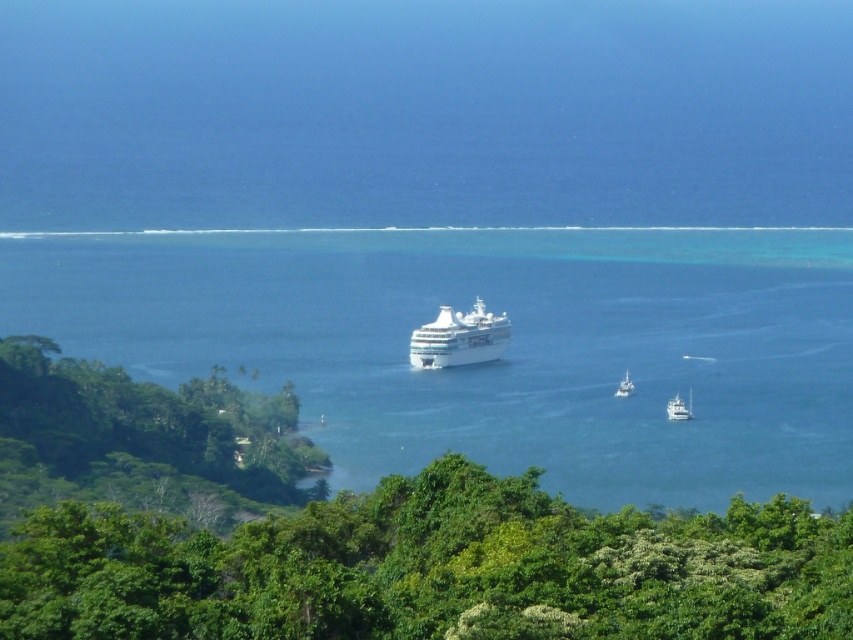
You are a photographer planning to capture both the white glossy boat at lower right and the white glossy boat at center in a single frame. Which boat should you position closer to the camera to ensure both are clearly visible in the photo?

You should position the white glossy boat at lower right closer to the camera because it is larger in size than the white glossy boat at center, ensuring both boats appear balanced in the frame.

Looking at this image, you are standing on the shore looking at the cruise ship. If you want to reach the blue water at center, which direction should you move relative to your current position?

The blue water at center is located at coordinates point (x=505, y=353), so you should move towards the central area of the water to reach it.

You are standing on the beach and see the blue water at center and the white glossy boat at lower right. Which object is closer to your right side?

The white glossy boat at lower right is closer to your right side because it is positioned to the right of the blue water at center.